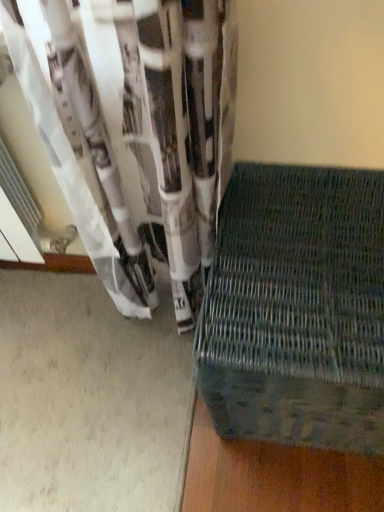
Locate an element on the screen. green woven basket at lower right is located at coordinates click(297, 309).

Describe the element at coordinates (297, 309) in the screenshot. I see `green woven basket at lower right` at that location.

The height and width of the screenshot is (512, 384). Find the location of `green woven basket at lower right`. green woven basket at lower right is located at coordinates click(x=297, y=309).